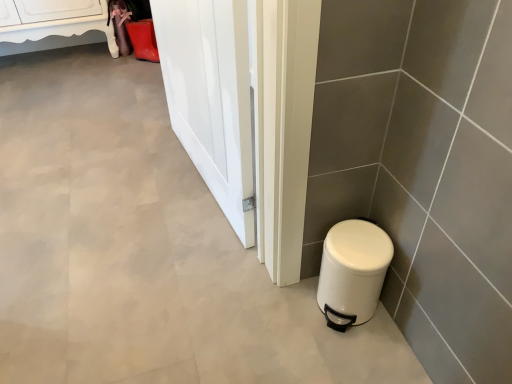
Question: Considering the positions of white matte trash can at lower right and white glossy cabinet at upper left in the image, is white matte trash can at lower right taller or shorter than white glossy cabinet at upper left?

Choices:
 (A) tall
 (B) short

Answer: (B)

Question: Is white matte trash can at lower right situated inside white glossy cabinet at upper left or outside?

Choices:
 (A) inside
 (B) outside

Answer: (B)

Question: Considering the real-world distances, which object is farthest from the white matte trash can at lower right?

Choices:
 (A) white glossy cabinet at upper left
 (B) white glossy door at center

Answer: (A)

Question: Estimate the real-world distances between objects in this image. Which object is closer to the white glossy door at center?

Choices:
 (A) white glossy cabinet at upper left
 (B) white matte trash can at lower right

Answer: (B)